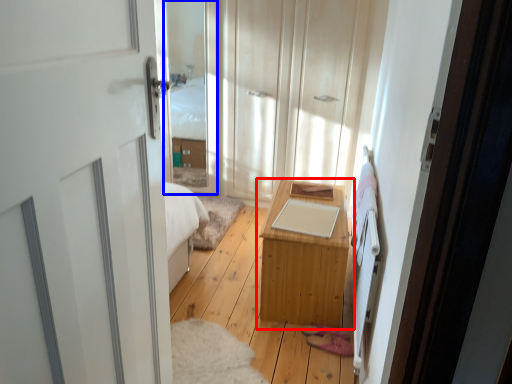
Question: Which object is further to the camera taking this photo, table (highlighted by a red box) or glass door (highlighted by a blue box)?

Choices:
 (A) table
 (B) glass door

Answer: (B)